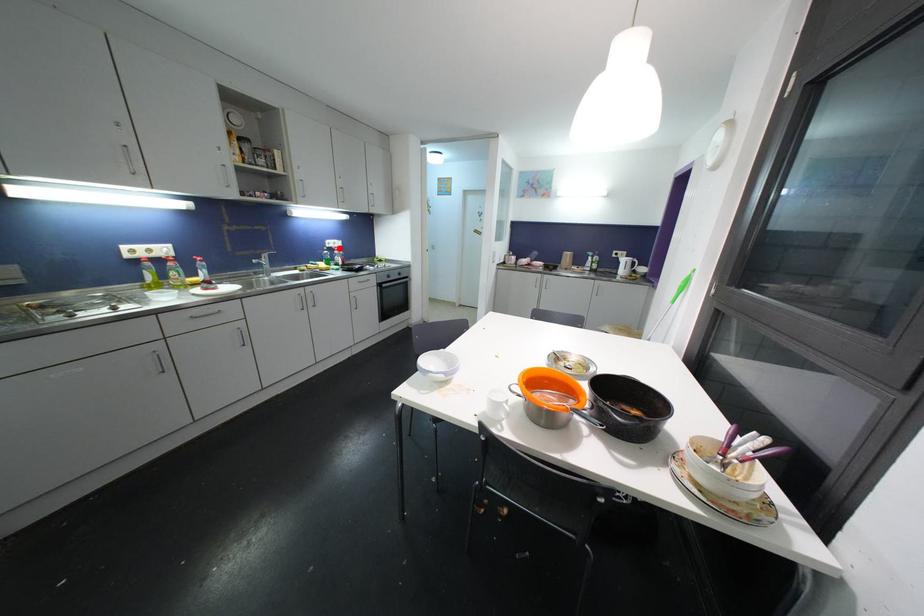
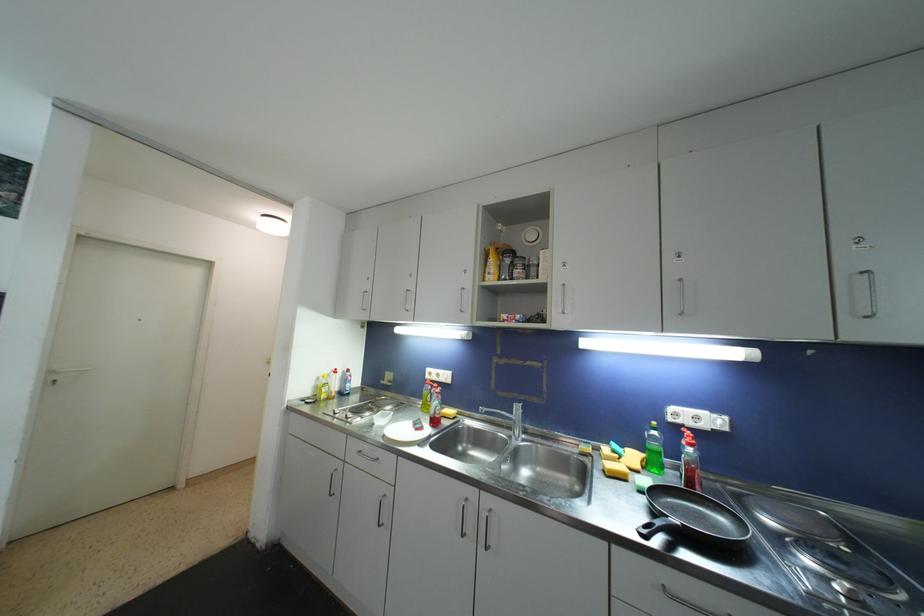
Locate, in the second image, the point that corresponds to the highlighted location in the first image.

(708, 429)